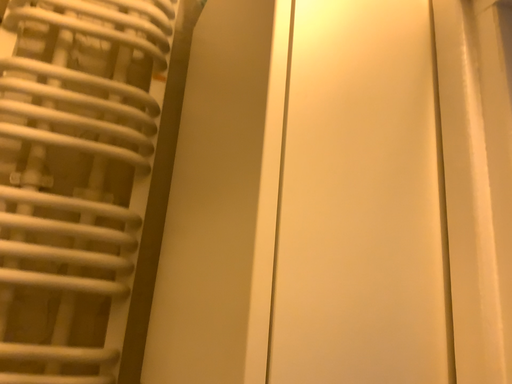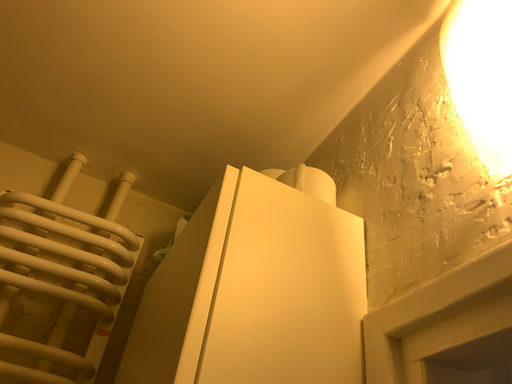
Question: How did the camera likely rotate when shooting the video?

Choices:
 (A) rotated upward
 (B) rotated downward

Answer: (A)